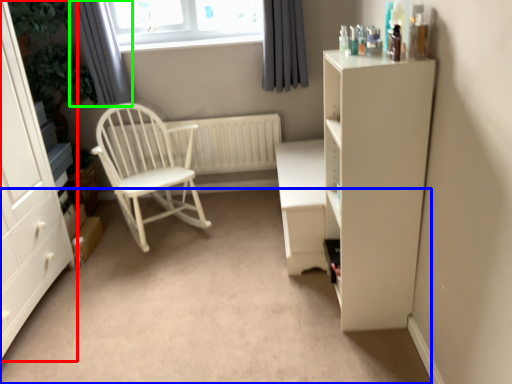
Question: Which is nearer to the cabinetry (highlighted by a red box)? plain (highlighted by a blue box) or curtain (highlighted by a green box).

Choices:
 (A) plain
 (B) curtain

Answer: (A)